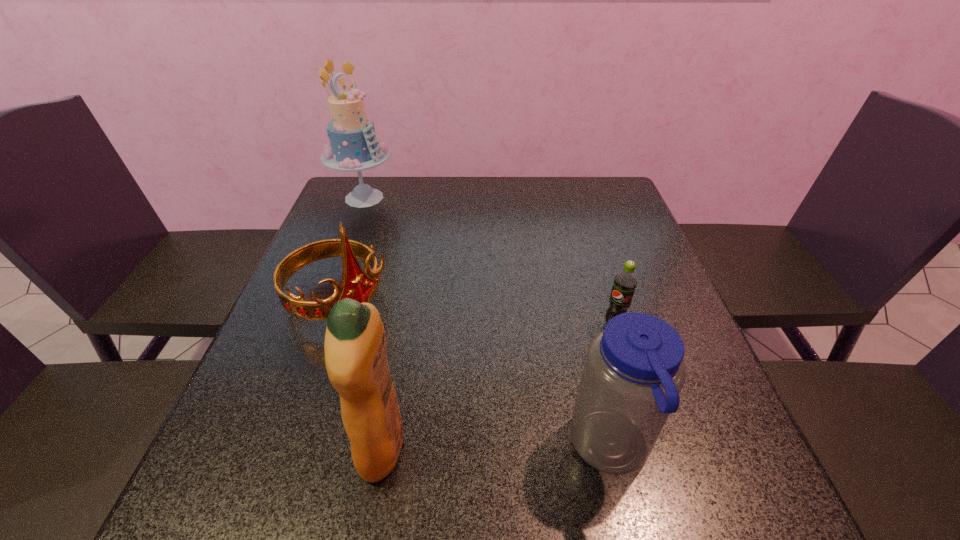
Locate an element on the screen. This screenshot has width=960, height=540. object present at the near right corner is located at coordinates (634, 370).

You are a GUI agent. You are given a task and a screenshot of the screen. Output one action in this format:
    pyautogui.click(x=<x>, y=<y>)
    Task: Click on the vacant area at the far edge
    The height and width of the screenshot is (540, 960).
    Given the screenshot: What is the action you would take?
    pyautogui.click(x=569, y=195)

Find the location of a particular element. Image resolution: width=960 pixels, height=540 pixels. vacant space at the near edge of the desktop is located at coordinates (431, 429).

At what (x,y) coordinates should I click in order to perform the action: click on vacant space at the left edge of the desktop. Please return your answer as a coordinate pair (x, y). Looking at the image, I should click on (276, 336).

The image size is (960, 540). In order to click on free location at the right edge in this screenshot , I will do `click(629, 243)`.

In the image, there is a desktop. At what (x,y) coordinates should I click in order to perform the action: click on vacant area at the near right corner. Please return your answer as a coordinate pair (x, y). This screenshot has width=960, height=540. Looking at the image, I should click on (698, 448).

Where is `vacant space that's between the fourth shortest object and the shortest object`? vacant space that's between the fourth shortest object and the shortest object is located at coordinates (498, 386).

Locate an element on the screen. The width and height of the screenshot is (960, 540). free point between the third object from right to left and the water bottle is located at coordinates (496, 448).

Locate an element on the screen. unoccupied position between the water bottle and the third object from left to right is located at coordinates tap(496, 448).

Where is `unoccupied position between the tiara and the shortest object`? The width and height of the screenshot is (960, 540). unoccupied position between the tiara and the shortest object is located at coordinates (476, 313).